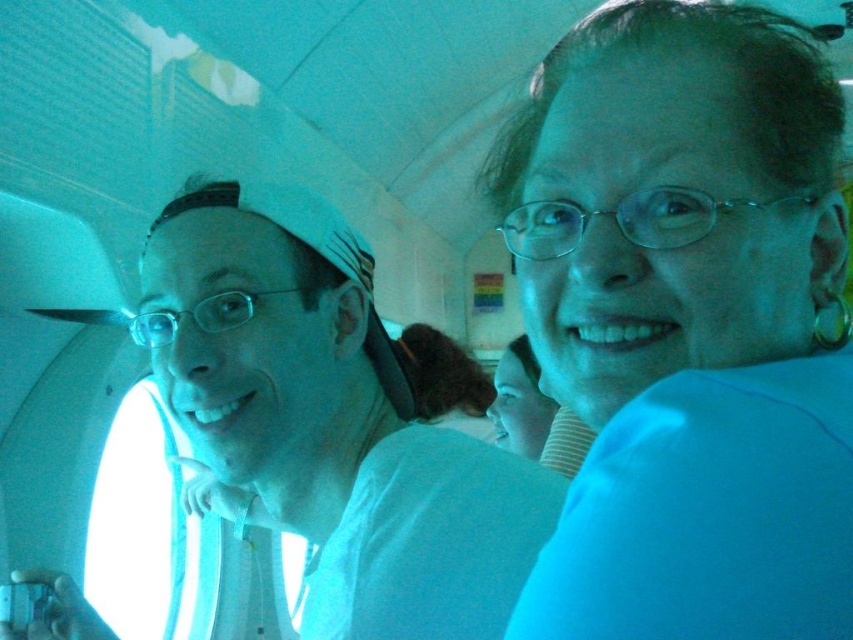
You are a photographer trying to capture a photo of the smooth skin face at center without including the blue fabric shirt at upper right in the frame. Based on their relative widths, is this possible?

The blue fabric shirt at upper right is wider than the smooth skin face at center, so it might be challenging to frame the smooth skin face at center without including the blue fabric shirt at upper right due to its greater width.

You are a flight attendant standing in the aircraft cabin. You need to place a 12 inch long tray of snacks between the blue fabric shirt at upper right and the white fabric at left. Can you fit the tray between them without overlapping either fabric?

The blue fabric shirt at upper right is 11.91 inches from the white fabric at left. Since the tray is 12 inches long, it is slightly longer than the available space. Therefore, the tray cannot be placed between them without overlapping one of the fabrics.

You are a photographer standing in an aircraft cabin with a blue filter. You need to adjust your camera to focus on the smooth skin face at center without blurring the white fabric at left. Can you keep both in focus if the depth of field allows objects within 4 feet to be sharp?

The distance between the white fabric at left and the smooth skin face at center is 4.22 feet. Since the depth of field can only keep objects within 4 feet sharp, the white fabric at left will be slightly out of focus while the smooth skin face at center remains sharp.